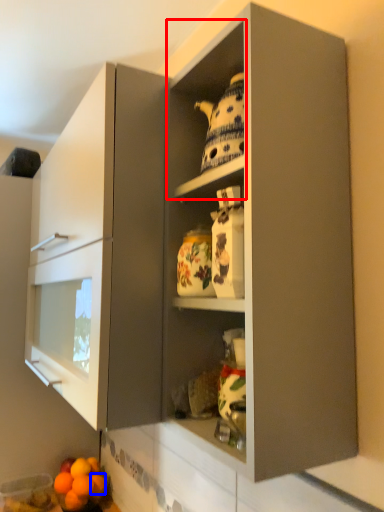
Question: Which object is closer to the camera taking this photo, cabinet (highlighted by a red box) or orange (highlighted by a blue box)?

Choices:
 (A) cabinet
 (B) orange

Answer: (A)